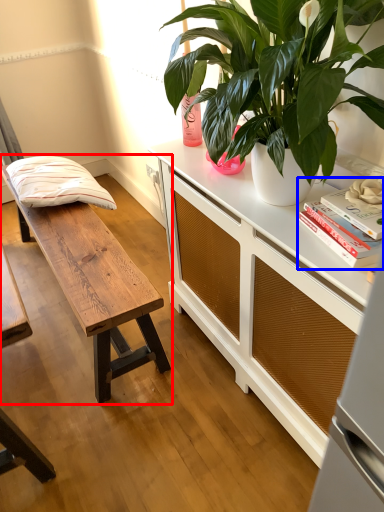
Question: Which object appears farthest to the camera in this image, table (highlighted by a red box) or book (highlighted by a blue box)?

Choices:
 (A) table
 (B) book

Answer: (A)